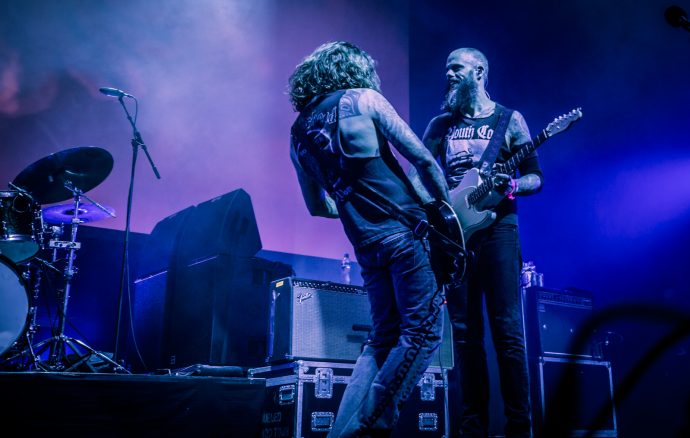
Where is `stand`? Image resolution: width=690 pixels, height=438 pixels. stand is located at coordinates (128, 242).